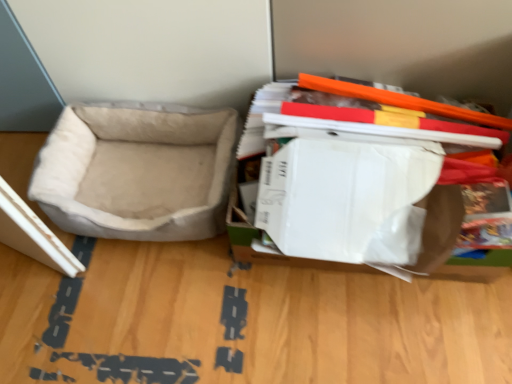
Question: Considering the positions of beige suede dog bed at left and white cardboard box at right in the image, is beige suede dog bed at left bigger or smaller than white cardboard box at right?

Choices:
 (A) big
 (B) small

Answer: (B)

Question: From their relative heights in the image, would you say beige suede dog bed at left is taller or shorter than white cardboard box at right?

Choices:
 (A) tall
 (B) short

Answer: (B)

Question: From the image's perspective, is beige suede dog bed at left located above or below white cardboard box at right?

Choices:
 (A) above
 (B) below

Answer: (A)

Question: From the image's perspective, is white cardboard box at right positioned above or below beige suede dog bed at left?

Choices:
 (A) below
 (B) above

Answer: (A)

Question: From a real-world perspective, relative to beige suede dog bed at left, is white cardboard box at right vertically above or below?

Choices:
 (A) below
 (B) above

Answer: (B)

Question: Considering the positions of point (344, 188) and point (46, 195), is point (344, 188) closer or farther from the camera than point (46, 195)?

Choices:
 (A) closer
 (B) farther

Answer: (A)

Question: Is white cardboard box at right bigger or smaller than beige suede dog bed at left?

Choices:
 (A) big
 (B) small

Answer: (A)